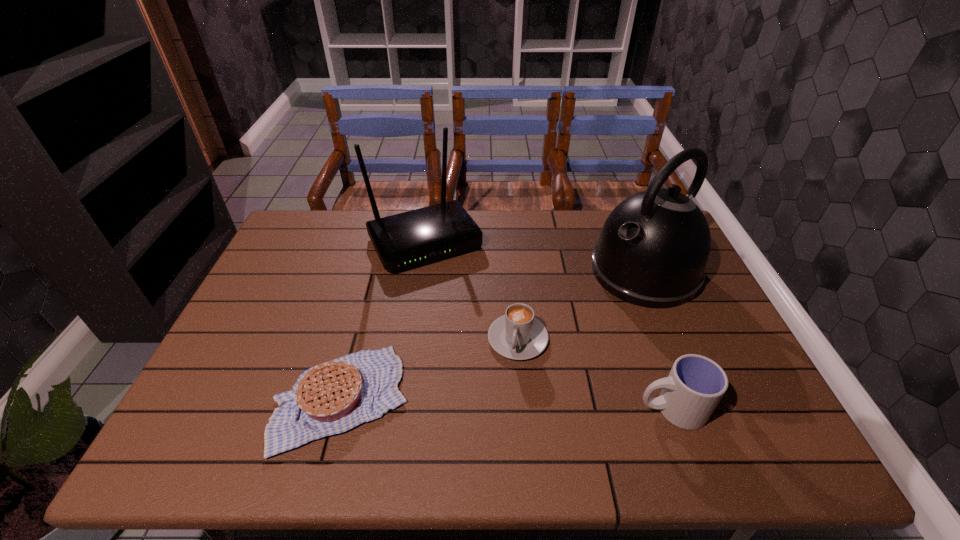
Locate an element on the screen. Image resolution: width=960 pixels, height=540 pixels. free space on the desktop that is between the shortest object and the third shortest object and is positioned to the right of the cappuccino is located at coordinates (500, 403).

Locate an element on the screen. This screenshot has height=540, width=960. vacant space on the desktop that is between the pie and the third tallest object and is positioned on the front-facing side of the router is located at coordinates (525, 404).

This screenshot has height=540, width=960. Identify the location of vacant spot on the desktop that is between the shortest object and the cup and is positioned on the spout of the tallest object. (460, 402).